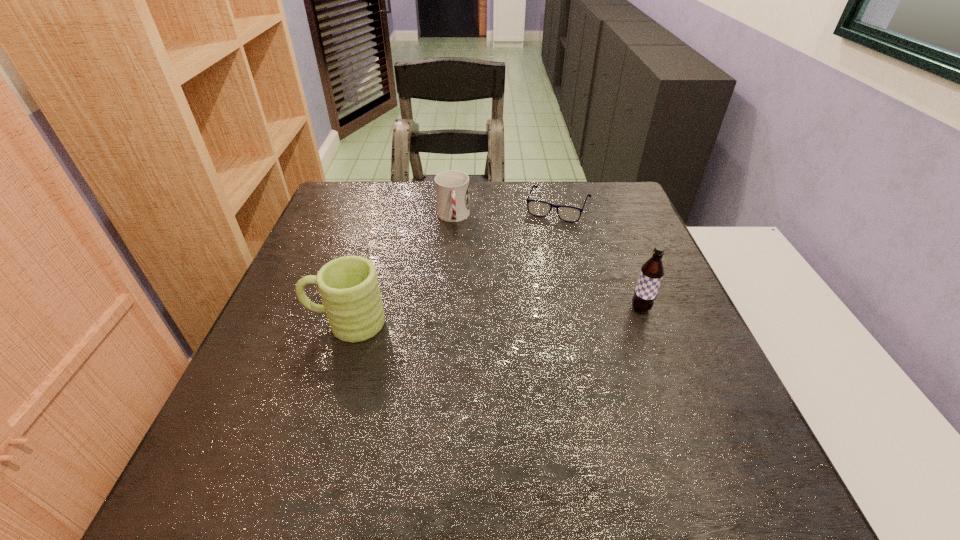
Image resolution: width=960 pixels, height=540 pixels. I want to click on the second tallest object, so click(x=348, y=286).

Image resolution: width=960 pixels, height=540 pixels. I want to click on mug, so click(x=348, y=286).

At what (x,y) coordinates should I click in order to perform the action: click on root beer. Please return your answer as a coordinate pair (x, y). The width and height of the screenshot is (960, 540). Looking at the image, I should click on (652, 271).

Locate an element on the screen. The height and width of the screenshot is (540, 960). spectacles is located at coordinates (537, 208).

Where is `the second shortest object`? The width and height of the screenshot is (960, 540). the second shortest object is located at coordinates (452, 187).

This screenshot has width=960, height=540. What are the coordinates of `the second object from left to right` in the screenshot? It's located at (452, 187).

The height and width of the screenshot is (540, 960). I want to click on free spot located 0.140m on the front of the root beer, so click(663, 369).

The width and height of the screenshot is (960, 540). In order to click on blank space located 0.250m on the front-facing side of the shortest object in this screenshot , I will do `click(531, 280)`.

I want to click on vacant space positioned 0.390m on the front-facing side of the shortest object, so coord(516,321).

Find the location of a particular element. The image size is (960, 540). free space located on the front-facing side of the shortest object is located at coordinates (516, 318).